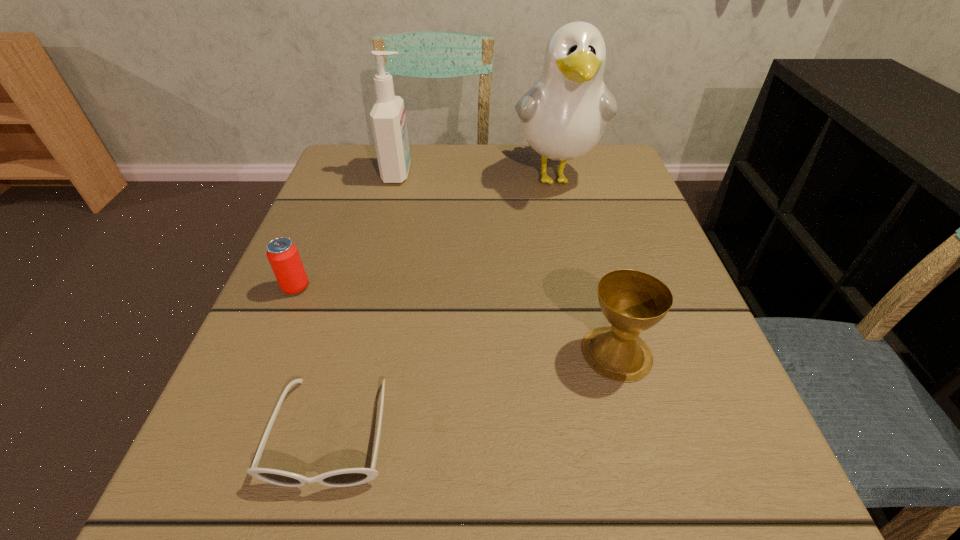
Where is `gull that is at the far edge`? gull that is at the far edge is located at coordinates (563, 116).

Where is `cleansing agent positioned at the far edge`? The width and height of the screenshot is (960, 540). cleansing agent positioned at the far edge is located at coordinates (388, 121).

This screenshot has height=540, width=960. What are the coordinates of `object that is at the near edge` in the screenshot? It's located at (348, 477).

Locate an element on the screen. cleansing agent located in the left edge section of the desktop is located at coordinates (388, 121).

Identify the location of beer can that is positioned at the left edge. The image size is (960, 540). (283, 256).

Where is `sunglasses present at the left edge`? sunglasses present at the left edge is located at coordinates (348, 477).

This screenshot has height=540, width=960. I want to click on gull that is at the right edge, so click(563, 116).

The width and height of the screenshot is (960, 540). I want to click on chalice present at the right edge, so click(632, 301).

Where is `object that is at the far left corner`? The height and width of the screenshot is (540, 960). object that is at the far left corner is located at coordinates (388, 121).

You are a GUI agent. You are given a task and a screenshot of the screen. Output one action in this format:
    pyautogui.click(x=<x>, y=<y>)
    Task: Click on the object that is at the near left corner
    The image size is (960, 540).
    Given the screenshot: What is the action you would take?
    pyautogui.click(x=348, y=477)